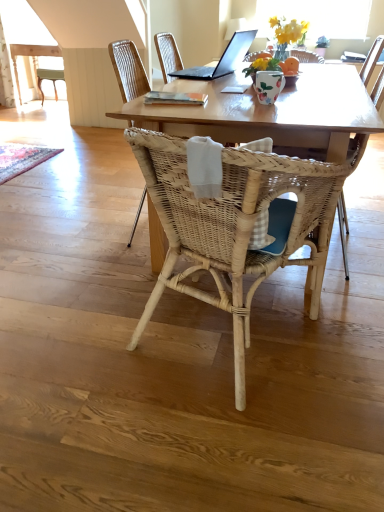
Question: From a real-world perspective, is natural wood table at center physically located above or below woven wood chair at center, positioned as the first chair in front-to-back order?

Choices:
 (A) above
 (B) below

Answer: (B)

Question: Is natural wood table at center wider or thinner than woven wood chair at center, the 2th chair positioned from the back?

Choices:
 (A) wide
 (B) thin

Answer: (A)

Question: Considering the real-world distances, which object is closest to the light wood table at upper left?

Choices:
 (A) black matte laptop at upper center
 (B) woven rattan chair at center
 (C) natural wood table at center
 (D) woven wood chair at center, which is counted as the second chair, starting from the front
 (E) woven wood chair at center, positioned as the first chair in front-to-back order

Answer: (D)

Question: Based on their relative distances, which object is nearer to the light wood table at upper left?

Choices:
 (A) rustic woven mat at lower left
 (B) floral ceramic vase at upper center
 (C) woven rattan chair at center
 (D) woven wood chair at center, the 2th chair positioned from the back
 (E) woven wood chair at center, which is counted as the 1th chair, starting from the back

Answer: (A)